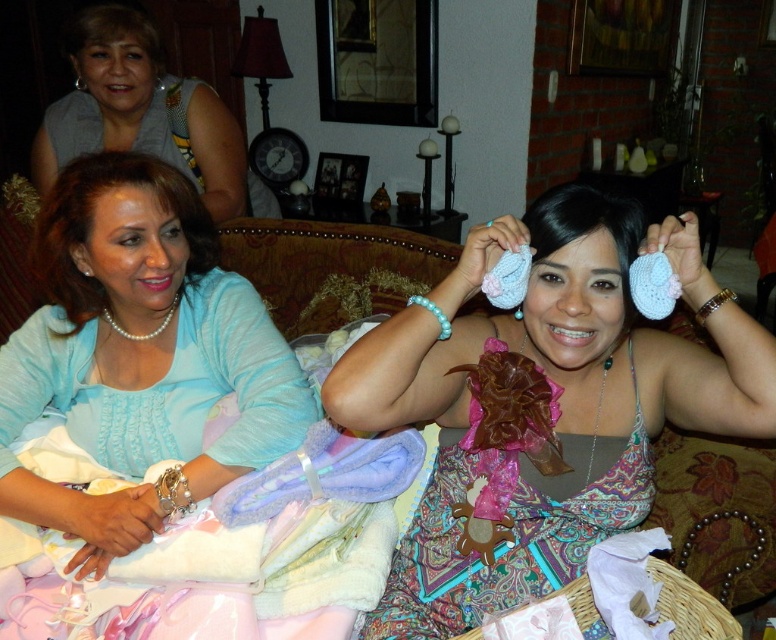
Is matte pink crochet booties at center taller than matte gray blouse at upper left?

Yes, matte pink crochet booties at center is taller than matte gray blouse at upper left.

Measure the distance between matte pink crochet booties at center and camera.

They are 35.41 inches apart.

Locate an element on the screen. The image size is (776, 640). matte pink crochet booties at center is located at coordinates (544, 403).

What do you see at coordinates (139, 355) in the screenshot?
I see `matte blue sweater at left` at bounding box center [139, 355].

Between matte blue sweater at left and matte gray blouse at upper left, which one appears on the right side from the viewer's perspective?

matte blue sweater at left is more to the right.

Who is more forward, (241, 324) or (101, 49)?

Point (241, 324)

This screenshot has height=640, width=776. I want to click on matte blue sweater at left, so click(x=139, y=355).

Does matte pink crochet booties at center appear under matte blue sweater at left?

Correct, matte pink crochet booties at center is located below matte blue sweater at left.

Does matte pink crochet booties at center have a greater width compared to matte blue sweater at left?

Indeed, matte pink crochet booties at center has a greater width compared to matte blue sweater at left.

In the scene shown: Who is more distant from viewer, (615, 234) or (89, 442)?

Point (89, 442)

Locate an element on the screen. The image size is (776, 640). matte pink crochet booties at center is located at coordinates click(x=544, y=403).